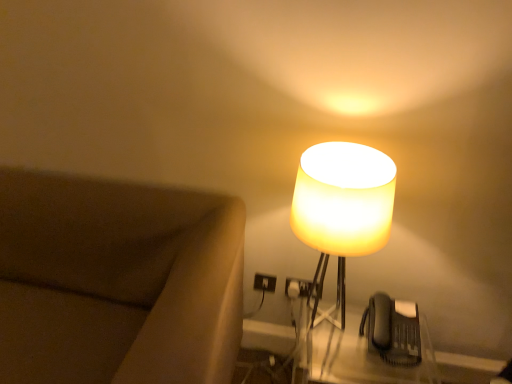
Question: Is there a large distance between translucent plastic table at lower right and translucent yellow glass lampshade at right?

Choices:
 (A) yes
 (B) no

Answer: (B)

Question: From the image's perspective, is translucent plastic table at lower right below translucent yellow glass lampshade at right?

Choices:
 (A) yes
 (B) no

Answer: (A)

Question: Considering the relative positions of translucent plastic table at lower right and translucent yellow glass lampshade at right in the image provided, is translucent plastic table at lower right in front of translucent yellow glass lampshade at right?

Choices:
 (A) yes
 (B) no

Answer: (B)

Question: Is translucent plastic table at lower right touching translucent yellow glass lampshade at right?

Choices:
 (A) yes
 (B) no

Answer: (B)

Question: Can you confirm if translucent plastic table at lower right is positioned to the right of translucent yellow glass lampshade at right?

Choices:
 (A) no
 (B) yes

Answer: (B)

Question: Could translucent yellow glass lampshade at right be considered to be inside translucent plastic table at lower right?

Choices:
 (A) no
 (B) yes

Answer: (A)

Question: Is the depth of translucent yellow glass lampshade at right greater than that of brown fabric couch at left?

Choices:
 (A) yes
 (B) no

Answer: (A)

Question: Does translucent yellow glass lampshade at right have a greater height compared to brown fabric couch at left?

Choices:
 (A) yes
 (B) no

Answer: (B)

Question: Can you confirm if translucent yellow glass lampshade at right is thinner than brown fabric couch at left?

Choices:
 (A) no
 (B) yes

Answer: (B)

Question: Is brown fabric couch at left inside translucent yellow glass lampshade at right?

Choices:
 (A) yes
 (B) no

Answer: (B)

Question: From the image's perspective, is translucent yellow glass lampshade at right above brown fabric couch at left?

Choices:
 (A) no
 (B) yes

Answer: (B)

Question: Can you confirm if translucent yellow glass lampshade at right is positioned to the left of brown fabric couch at left?

Choices:
 (A) yes
 (B) no

Answer: (B)

Question: From the image's perspective, is black plastic phone at lower right on top of translucent yellow glass lampshade at right?

Choices:
 (A) no
 (B) yes

Answer: (A)